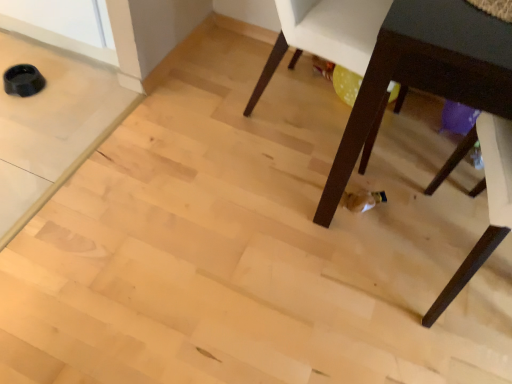
In order to click on blank space to the left of dark wood table at lower right in this screenshot , I will do (x=228, y=181).